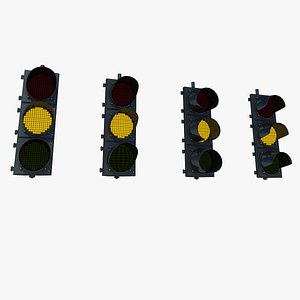
Where is `light4`? The image size is (300, 300). light4 is located at coordinates (256, 122).